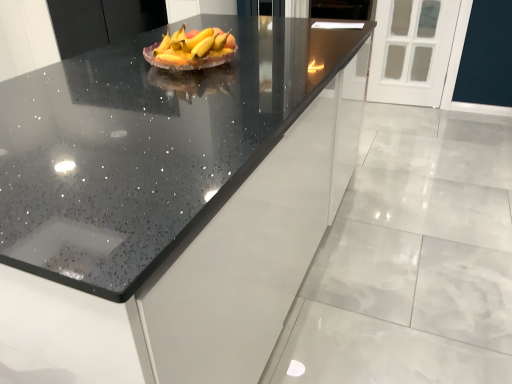
Question: Is black speckled countertop at center oriented away from black speckled countertop at center?

Choices:
 (A) yes
 (B) no

Answer: (B)

Question: Is black speckled countertop at center positioned far away from black speckled countertop at center?

Choices:
 (A) yes
 (B) no

Answer: (A)

Question: Can you confirm if black speckled countertop at center is smaller than black speckled countertop at center?

Choices:
 (A) yes
 (B) no

Answer: (A)

Question: Are black speckled countertop at center and black speckled countertop at center making contact?

Choices:
 (A) yes
 (B) no

Answer: (B)

Question: Can you confirm if black speckled countertop at center is taller than black speckled countertop at center?

Choices:
 (A) yes
 (B) no

Answer: (B)

Question: Is black speckled countertop at center to the right of black speckled countertop at center from the viewer's perspective?

Choices:
 (A) yes
 (B) no

Answer: (B)

Question: Does yellow matte grapefruit at center have a greater height compared to black speckled countertop at center?

Choices:
 (A) yes
 (B) no

Answer: (B)

Question: Is yellow matte grapefruit at center shorter than black speckled countertop at center?

Choices:
 (A) yes
 (B) no

Answer: (A)

Question: Does yellow matte grapefruit at center have a lesser width compared to black speckled countertop at center?

Choices:
 (A) yes
 (B) no

Answer: (A)

Question: Are yellow matte grapefruit at center and black speckled countertop at center beside each other?

Choices:
 (A) no
 (B) yes

Answer: (A)

Question: Could you tell me if yellow matte grapefruit at center is turned towards black speckled countertop at center?

Choices:
 (A) yes
 (B) no

Answer: (B)

Question: From the image's perspective, is yellow matte grapefruit at center under black speckled countertop at center?

Choices:
 (A) no
 (B) yes

Answer: (B)

Question: Can you see yellow matte grapefruit at center touching black speckled countertop at center?

Choices:
 (A) yes
 (B) no

Answer: (B)